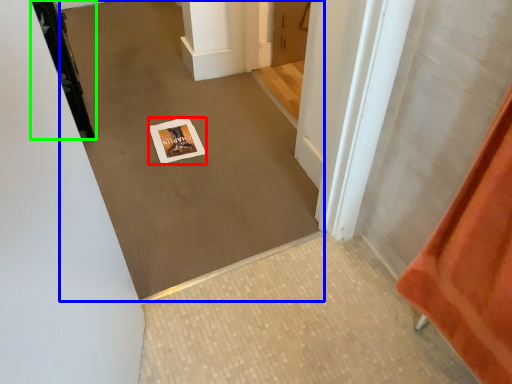
Question: Which is nearer to the postcard (highlighted by a red box)? plain (highlighted by a blue box) or door (highlighted by a green box).

Choices:
 (A) plain
 (B) door

Answer: (A)